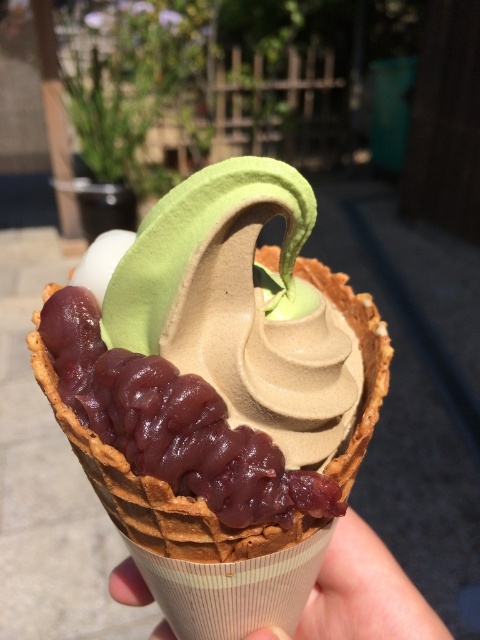
Between smooth chocolate ice cream cone at center and smooth beige cone at center, which one is positioned higher?

Positioned higher is smooth chocolate ice cream cone at center.

Is smooth chocolate ice cream cone at center thinner than smooth beige cone at center?

Incorrect, smooth chocolate ice cream cone at center's width is not less than smooth beige cone at center's.

Is point (305, 348) less distant than point (324, 630)?

That is True.

Where is `smooth chocolate ice cream cone at center`? This screenshot has width=480, height=640. smooth chocolate ice cream cone at center is located at coordinates (215, 394).